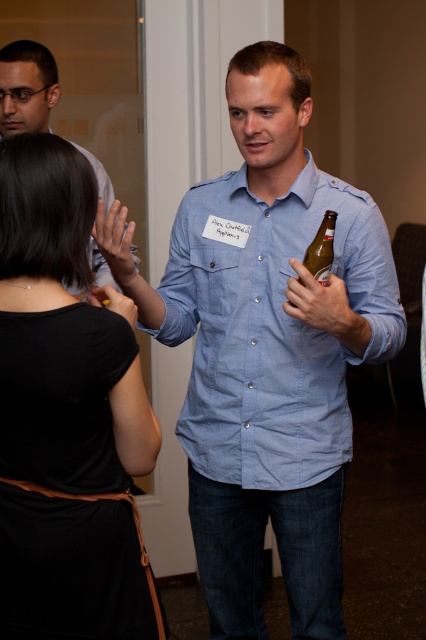
Question: Which point is farther to the camera?

Choices:
 (A) black fabric dress at upper left
 (B) blue denim shirt at center
 (C) translucent glass bottle at center

Answer: (B)

Question: Can you confirm if black fabric dress at upper left is thinner than blue denim shirt at center?

Choices:
 (A) no
 (B) yes

Answer: (B)

Question: Is blue denim shirt at center to the left of translucent glass bottle at center from the viewer's perspective?

Choices:
 (A) yes
 (B) no

Answer: (A)

Question: Does blue denim shirt at center have a greater width compared to translucent glass bottle at center?

Choices:
 (A) yes
 (B) no

Answer: (A)

Question: Estimate the real-world distances between objects in this image. Which object is farther from the matte black shirt at upper left?

Choices:
 (A) translucent glass bottle at center
 (B) blue denim shirt at center
 (C) black fabric dress at upper left

Answer: (A)

Question: Which point is farther to the camera?

Choices:
 (A) blue denim shirt at center
 (B) matte black shirt at upper left
 (C) black fabric dress at upper left

Answer: (B)